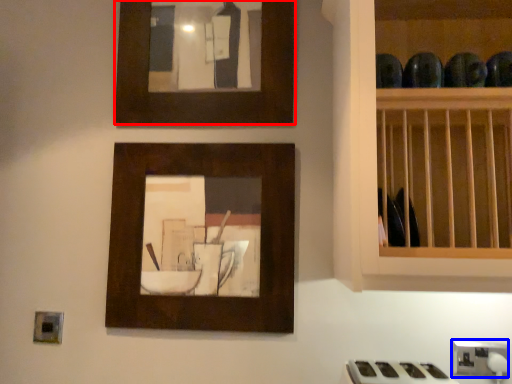
Question: Which of the following is the farthest to the observer, picture frame (highlighted by a red box) or electric outlet (highlighted by a blue box)?

Choices:
 (A) picture frame
 (B) electric outlet

Answer: (A)